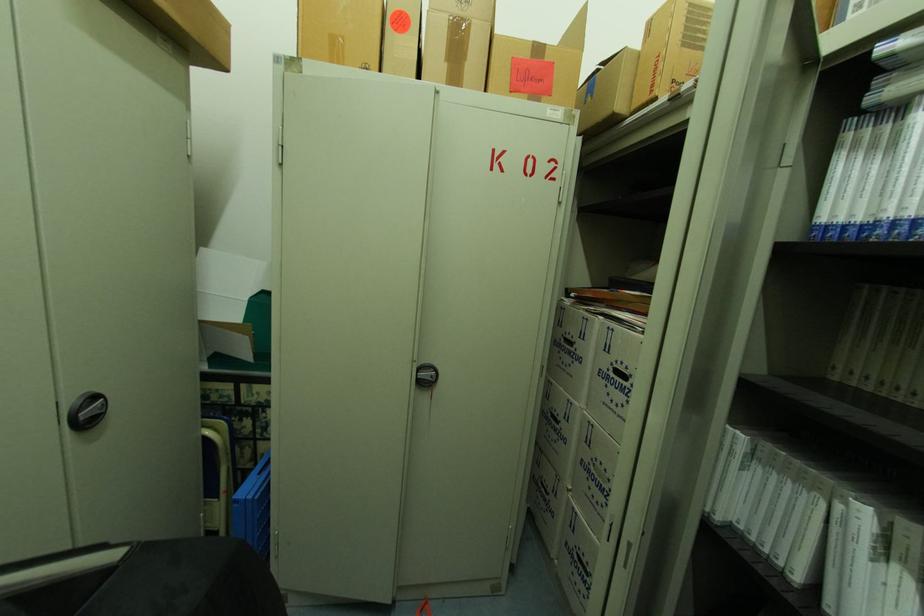
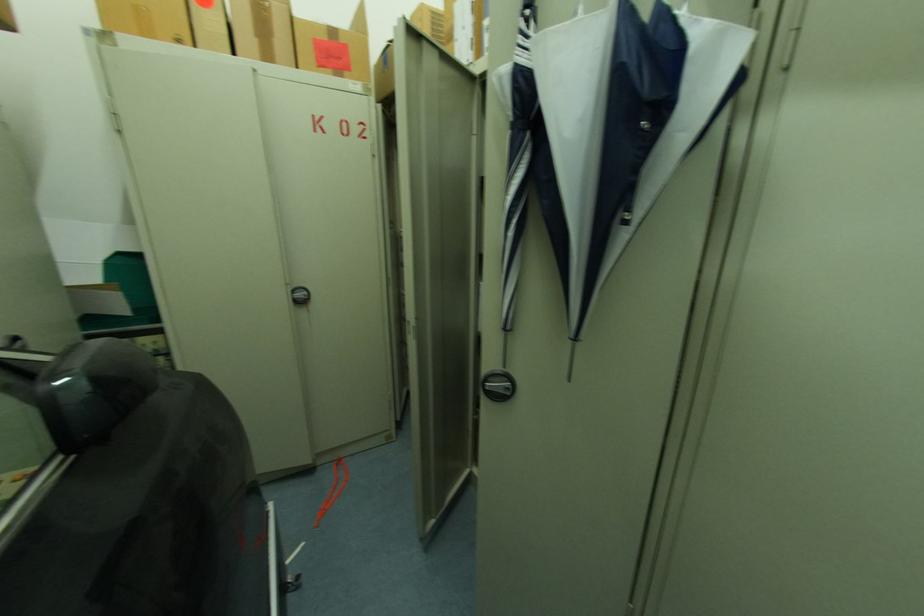
Question: The images are taken continuously from a first-person perspective. In which direction are you moving?

Choices:
 (A) Left
 (B) Right
 (C) Forward
 (D) Backward

Answer: (D)